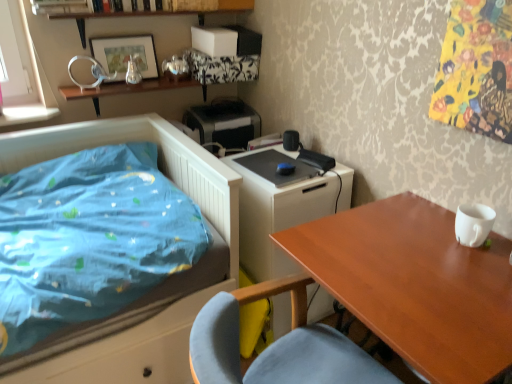
What is the approximate width of black plastic printer at upper center?

black plastic printer at upper center is 11.02 inches in width.

What do you see at coordinates (125, 54) in the screenshot? I see `metallic silver picture frame at upper left` at bounding box center [125, 54].

Find the location of a particular element. black plastic printer at upper center is located at coordinates (224, 123).

Between blue fabric bed at left and wooden table at right, which one has smaller width?

wooden table at right.

Is blue fabric bed at left in contact with wooden table at right?

There is a gap between blue fabric bed at left and wooden table at right.

Who is smaller, blue fabric bed at left or wooden table at right?

wooden table at right.

From the image's perspective, is blue fabric bed at left positioned above or below wooden table at right?

blue fabric bed at left is above wooden table at right.

Looking at this image, from the image's perspective, which object appears higher, blue fabric bed at left or black plastic printer at upper center?

black plastic printer at upper center appears higher in the image.

Between blue fabric bed at left and black plastic printer at upper center, which one appears on the right side from the viewer's perspective?

Positioned to the right is black plastic printer at upper center.

Does blue fabric bed at left lie behind black plastic printer at upper center?

No, it is in front of black plastic printer at upper center.

From a real-world perspective, does blue fabric bed at left sit lower than black plastic printer at upper center?

Yes, from a real-world perspective, blue fabric bed at left is beneath black plastic printer at upper center.

From their relative heights in the image, would you say white glossy changing table at center is taller or shorter than black plastic printer at upper center?

In the image, white glossy changing table at center appears to be taller than black plastic printer at upper center.

From the image's perspective, is white glossy changing table at center located beneath black plastic printer at upper center?

Yes.

Consider the image. Is white glossy changing table at center outside of black plastic printer at upper center?

Yes, white glossy changing table at center is not within black plastic printer at upper center.

Does point (298, 168) come farther from viewer compared to point (216, 141)?

No.

Is wooden table at right surrounded by white glossy changing table at center?

Actually, wooden table at right is outside white glossy changing table at center.

Is white glossy changing table at center looking in the opposite direction of wooden table at right?

No, white glossy changing table at center is not facing the opposite direction of wooden table at right.

Measure the distance between white glossy changing table at center and wooden table at right.

white glossy changing table at center and wooden table at right are 16.28 inches apart from each other.

Considering the relative sizes of white glossy changing table at center and wooden table at right in the image provided, is white glossy changing table at center wider than wooden table at right?

No.

From the image's perspective, between metallic silver picture frame at upper left and black plastic printer at upper center, who is located below?

From the image's view, black plastic printer at upper center is below.

From the picture: Is metallic silver picture frame at upper left turned away from black plastic printer at upper center?

Answer: metallic silver picture frame at upper left does not have its back to black plastic printer at upper center.

In the scene shown: Is metallic silver picture frame at upper left not close to black plastic printer at upper center?

No, there isn't a large distance between metallic silver picture frame at upper left and black plastic printer at upper center.

Is blue fabric bed at left beside white glossy changing table at center?

blue fabric bed at left and white glossy changing table at center are not in contact.

Considering the sizes of blue fabric bed at left and white glossy changing table at center in the image, is blue fabric bed at left bigger or smaller than white glossy changing table at center?

blue fabric bed at left is bigger than white glossy changing table at center.

Which object is positioned more to the left, blue fabric bed at left or white glossy changing table at center?

blue fabric bed at left is more to the left.

From a real-world perspective, who is located higher, wooden table at right or metallic silver picture frame at upper left?

In real-world perspective, metallic silver picture frame at upper left is above.

In the scene shown: From the image's perspective, which is below, wooden table at right or metallic silver picture frame at upper left?

wooden table at right appears lower in the image.

Who is smaller, wooden table at right or metallic silver picture frame at upper left?

With smaller size is metallic silver picture frame at upper left.

Is wooden table at right not close to metallic silver picture frame at upper left?

wooden table at right is positioned a significant distance from metallic silver picture frame at upper left.

The width and height of the screenshot is (512, 384). What are the coordinates of `table in front of the blue fabric bed at left` in the screenshot? It's located at (415, 284).

Identify the location of printer above the blue fabric bed at left (from a real-world perspective). This screenshot has height=384, width=512. pos(224,123).

Looking at the image, which one is located closer to black plastic printer at upper center, metallic silver picture frame at upper left or white glossy changing table at center?

Based on the image, metallic silver picture frame at upper left appears to be nearer to black plastic printer at upper center.

Estimate the real-world distances between objects in this image. Which object is further from metallic silver picture frame at upper left, black plastic printer at upper center or wooden table at right?

The object further to metallic silver picture frame at upper left is wooden table at right.

Which object lies further to the anchor point white glossy changing table at center, metallic silver picture frame at upper left or black plastic printer at upper center?

→ Based on the image, metallic silver picture frame at upper left appears to be further to white glossy changing table at center.

Which object lies further to the anchor point wooden table at right, blue fabric bed at left or white glossy changing table at center?

Based on the image, blue fabric bed at left appears to be further to wooden table at right.

Which object lies further to the anchor point white glossy changing table at center, black plastic printer at upper center or metallic silver picture frame at upper left?

metallic silver picture frame at upper left is further to white glossy changing table at center.

Estimate the real-world distances between objects in this image. Which object is closer to blue fabric bed at left, black plastic printer at upper center or metallic silver picture frame at upper left?

black plastic printer at upper center lies closer to blue fabric bed at left than the other object.

Looking at the image, which one is located further to metallic silver picture frame at upper left, wooden table at right or white glossy changing table at center?

Based on the image, wooden table at right appears to be further to metallic silver picture frame at upper left.

Based on their spatial positions, is white glossy changing table at center or black plastic printer at upper center further from blue fabric bed at left?

Based on the image, black plastic printer at upper center appears to be further to blue fabric bed at left.

Where is `changing table between metallic silver picture frame at upper left and wooden table at right in the vertical direction`? The width and height of the screenshot is (512, 384). changing table between metallic silver picture frame at upper left and wooden table at right in the vertical direction is located at coordinates (281, 206).

Locate an element on the screen. changing table that lies between metallic silver picture frame at upper left and blue fabric bed at left from top to bottom is located at coordinates (281, 206).

The image size is (512, 384). Find the location of `printer between metallic silver picture frame at upper left and white glossy changing table at center from top to bottom`. printer between metallic silver picture frame at upper left and white glossy changing table at center from top to bottom is located at coordinates (224, 123).

At what (x,y) coordinates should I click in order to perform the action: click on picture frame between wooden table at right and black plastic printer at upper center from front to back. Please return your answer as a coordinate pair (x, y). Image resolution: width=512 pixels, height=384 pixels. Looking at the image, I should click on (125, 54).